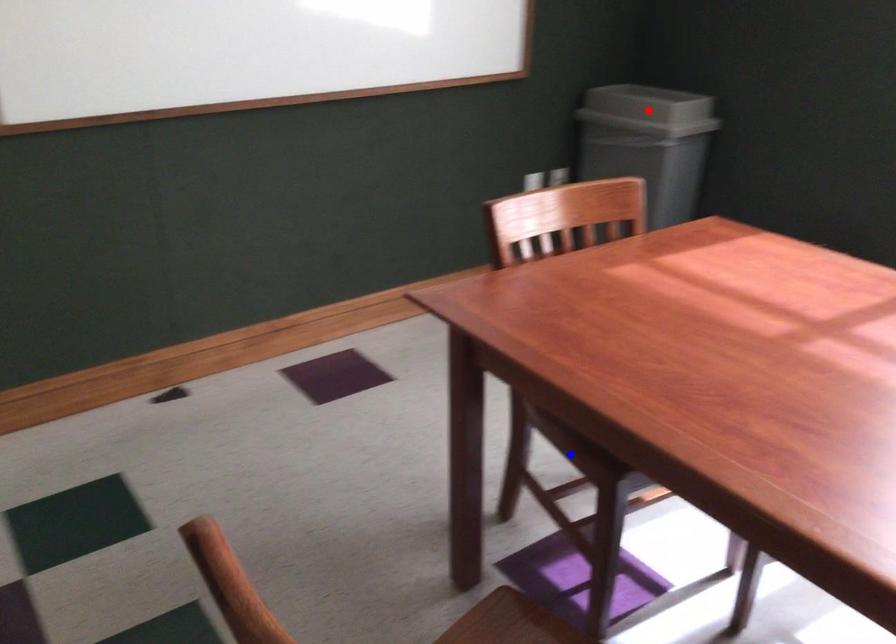
Question: Two points are marked on the image. Which point is closer to the camera?

Choices:
 (A) Blue point is closer.
 (B) Red point is closer.

Answer: (A)